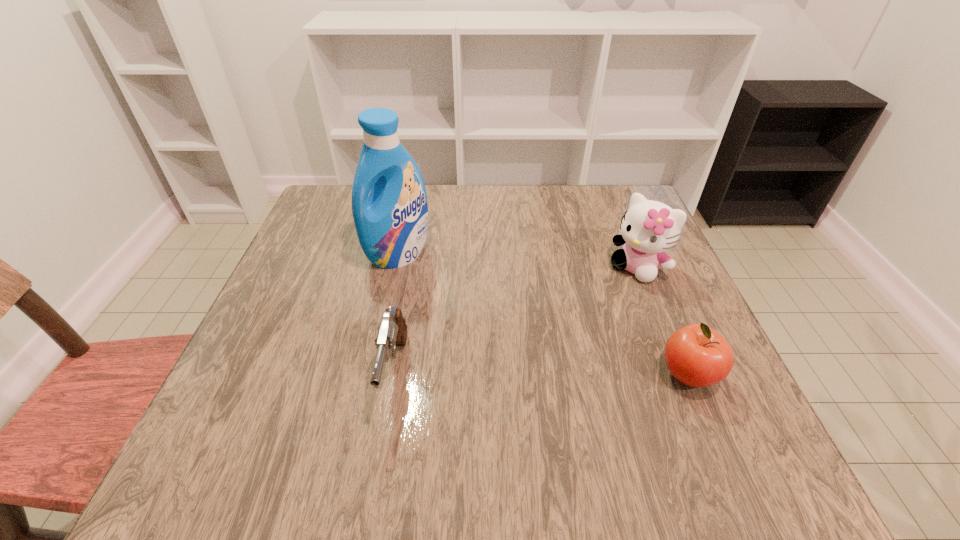
Select which object appears as the third closest to the pistol. Please provide its 2D coordinates. Your answer should be formatted as a tuple, i.e. [(x, y)], where the tuple contains the x and y coordinates of a point satisfying the conditions above.

[(696, 355)]

Identify the location of object that is the second closest to the tallest object. The image size is (960, 540). (648, 228).

At what (x,y) coordinates should I click in order to perform the action: click on vacant area that satisfies the following two spatial constraints: 1. at the barrel of the apple; 2. on the right side of the pistol. Please return your answer as a coordinate pair (x, y). Image resolution: width=960 pixels, height=540 pixels. Looking at the image, I should click on (394, 374).

Identify the location of free point that satisfies the following two spatial constraints: 1. at the barrel of the apple; 2. on the right side of the pistol. (394, 374).

Locate an element on the screen. This screenshot has height=540, width=960. free space that satisfies the following two spatial constraints: 1. on the front side of the tallest object; 2. on the right side of the apple is located at coordinates (372, 374).